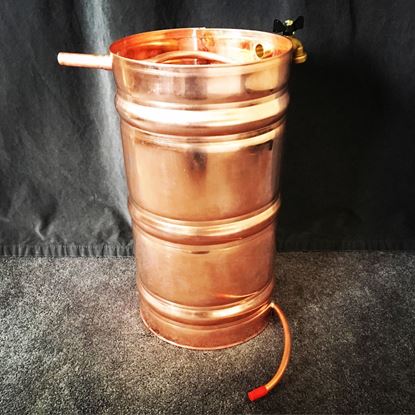
Identify the location of gray carpet. (107, 337).